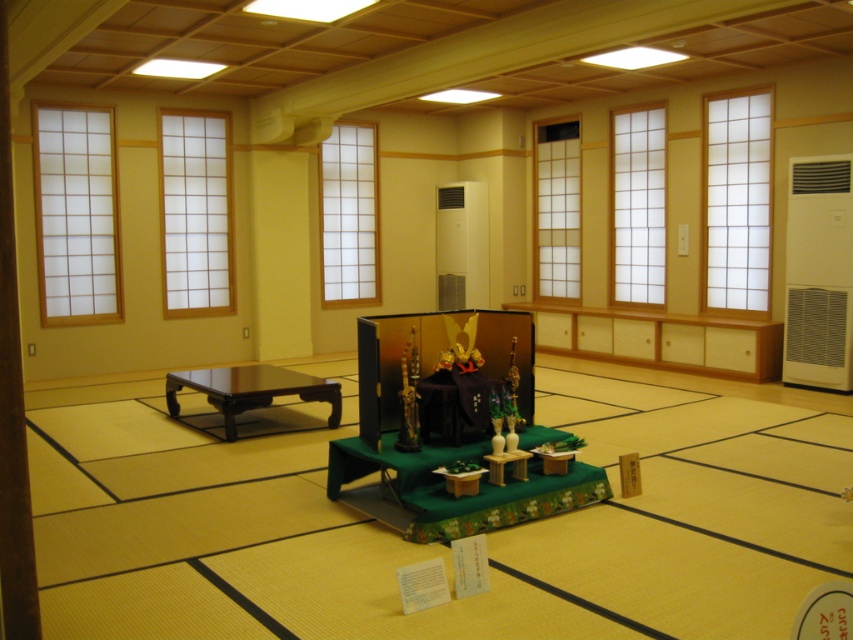
Which is behind, point (28, 525) or point (251, 365)?

Point (251, 365)

The image size is (853, 640). Identify the location of brown wooden pillar at left. (12, 406).